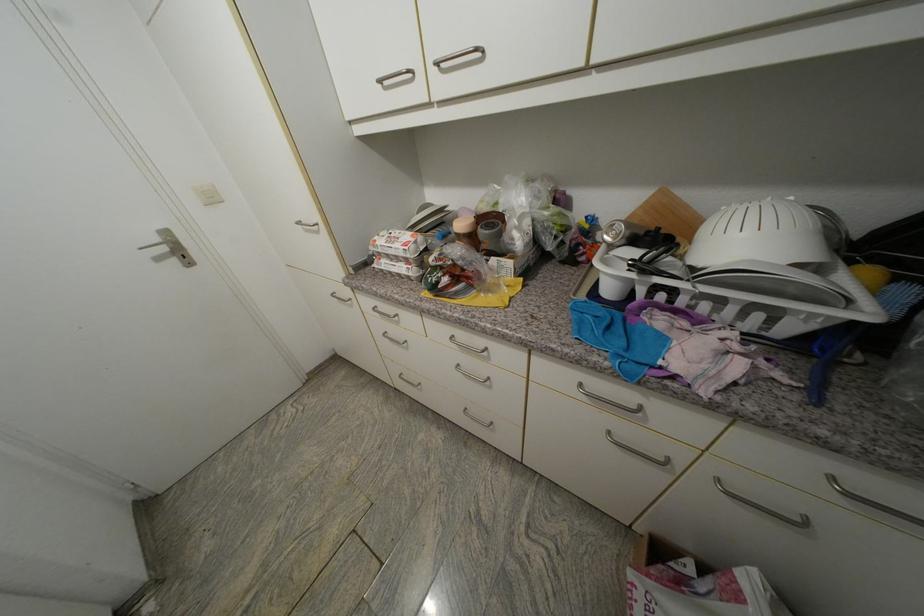
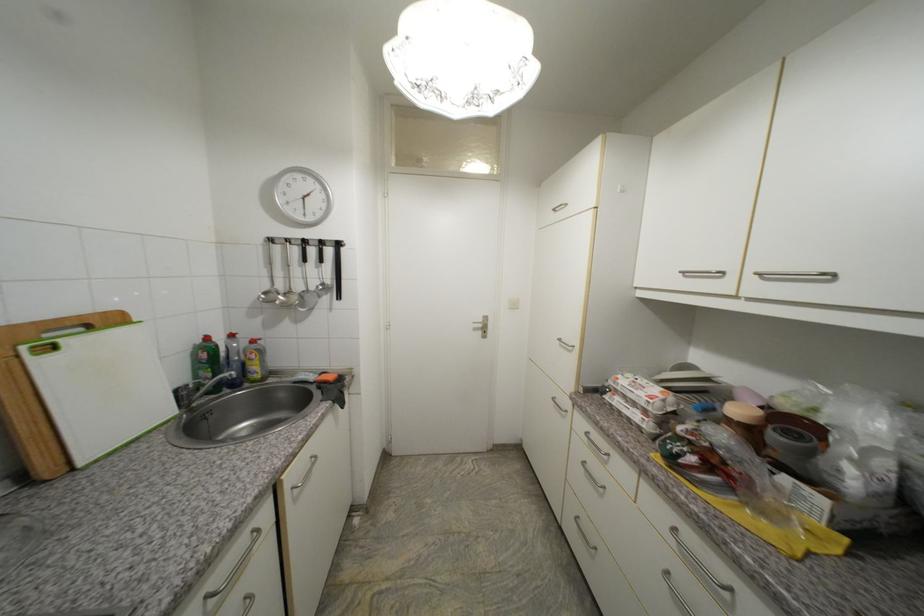
In the second image, find the point that corresponds to point 496,221 in the first image.

(803, 428)